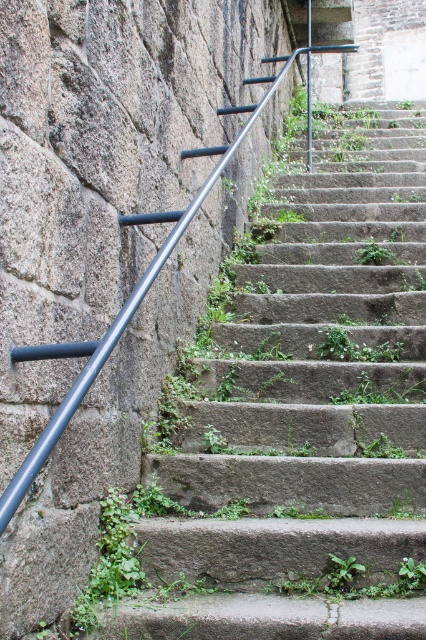
Consider the image. You are a painter standing at the bottom of the smooth concrete stairs at center. You want to paint the green leafy weed at center that is growing between the steps. Since you can only paint objects that are at least 2 feet tall, can you paint it?

The smooth concrete stairs at center is taller than green leafy weed at center. Since the weed is shorter than the stairs, and the stairs are presumably taller than 2 feet, the weed might still be tall enough. However, without knowing the exact height of the weed, we cannot confirm if it meets the 2 feet requirement. Please measure the weed first.